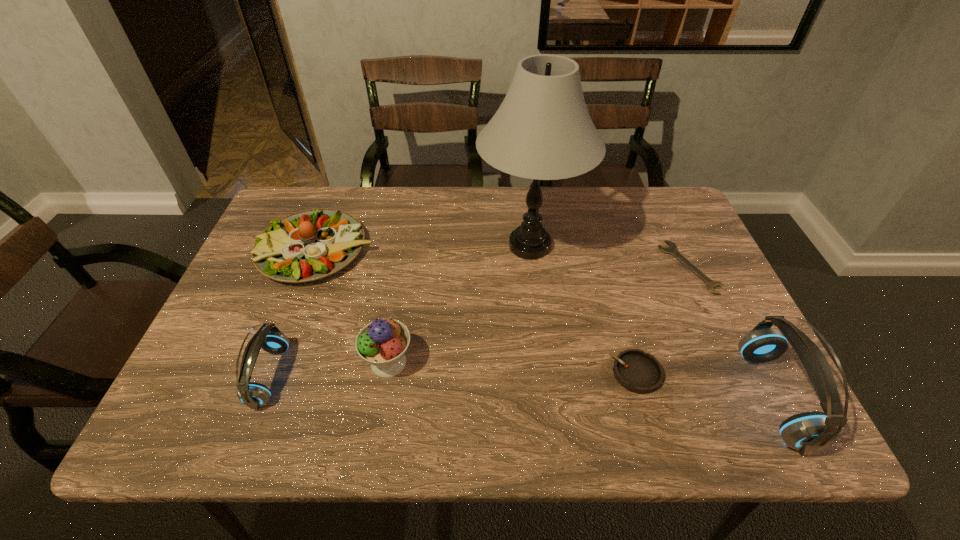
Identify the location of vacant region at the far right corner of the desktop. (640, 194).

Where is `vacant area at the near right corner of the desktop`? The height and width of the screenshot is (540, 960). vacant area at the near right corner of the desktop is located at coordinates (769, 372).

Identify the location of free spot between the lamp and the second tallest object. The height and width of the screenshot is (540, 960). (651, 321).

You are a GUI agent. You are given a task and a screenshot of the screen. Output one action in this format:
    pyautogui.click(x=<x>, y=<y>)
    Task: Click on the free spot between the fifth object from right to left and the ashtray
    The image size is (960, 540).
    Given the screenshot: What is the action you would take?
    pyautogui.click(x=512, y=368)

The height and width of the screenshot is (540, 960). I want to click on vacant area that lies between the tallest object and the wrench, so click(x=610, y=256).

Identify the location of vacant area between the right headset and the lamp. (651, 321).

What are the coordinates of `free space between the third object from left to right and the right headset` in the screenshot? It's located at (581, 380).

Identify the location of vacant space in between the taller headset and the icecream. The width and height of the screenshot is (960, 540). (581, 380).

Locate an element on the screen. This screenshot has width=960, height=540. free space that is in between the wrench and the second tallest object is located at coordinates (732, 333).

Identify the location of empty space between the fifth object from right to left and the salad plate. The width and height of the screenshot is (960, 540). (352, 306).